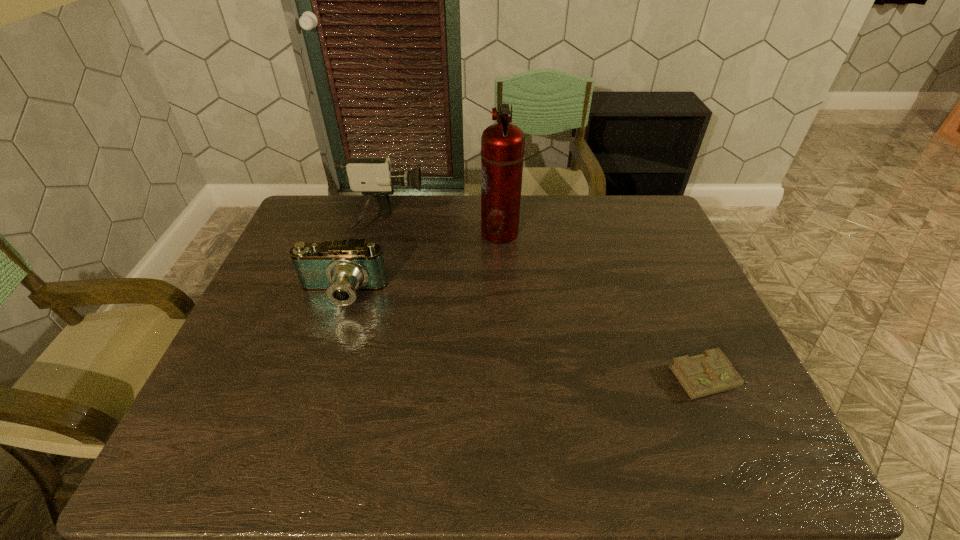
This screenshot has width=960, height=540. What are the coordinates of `vacant space located on the nozzle side of the third object from left to right` in the screenshot? It's located at (380, 232).

Find the location of a particular element. The image size is (960, 540). free region located 0.340m on the recording direction of the second tallest object is located at coordinates (523, 224).

Where is `free space located 0.050m on the front-facing side of the second nearest object`? The height and width of the screenshot is (540, 960). free space located 0.050m on the front-facing side of the second nearest object is located at coordinates (331, 328).

Where is `free region located on the back of the nearest object`? free region located on the back of the nearest object is located at coordinates (665, 281).

This screenshot has height=540, width=960. What are the coordinates of `fire extinguisher positioned at the far edge` in the screenshot? It's located at (502, 144).

In order to click on camcorder that is at the far edge in this screenshot , I will do `click(373, 177)`.

At what (x,y) coordinates should I click in order to perform the action: click on object located in the left edge section of the desktop. Please return your answer as a coordinate pair (x, y). Looking at the image, I should click on (340, 268).

Identify the location of object that is at the right edge. This screenshot has width=960, height=540. (711, 372).

I want to click on free space at the far edge of the desktop, so click(x=404, y=218).

At what (x,y) coordinates should I click in order to perform the action: click on free region at the near edge. Please return your answer as a coordinate pair (x, y). Looking at the image, I should click on (409, 435).